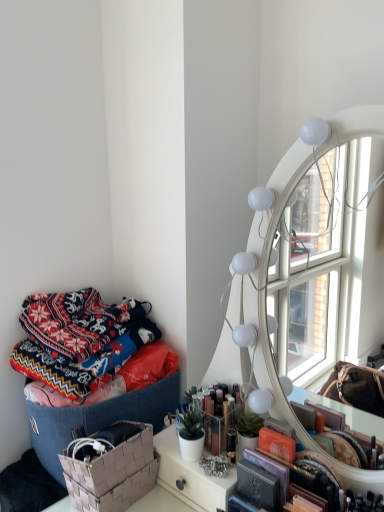
Question: In terms of width, does knitted woolen blanket at left look wider or thinner when compared to beige woven basket at lower left?

Choices:
 (A) thin
 (B) wide

Answer: (B)

Question: In terms of size, does knitted woolen blanket at left appear bigger or smaller than beige woven basket at lower left?

Choices:
 (A) big
 (B) small

Answer: (A)

Question: Based on their relative distances, which object is nearer to the textured woven basket at left?

Choices:
 (A) knitted woolen blanket at left
 (B) beige woven basket at lower left

Answer: (B)

Question: Which object is positioned closest to the textured woven basket at left?

Choices:
 (A) beige woven basket at lower left
 (B) knitted woolen blanket at left

Answer: (A)